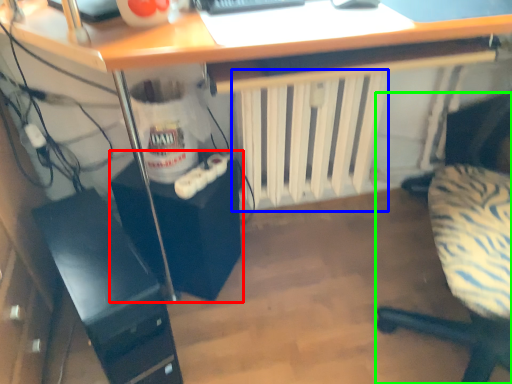
Question: Which is farther away from computer tower (highlighted by a red box)? radiator (highlighted by a blue box) or chair (highlighted by a green box)?

Choices:
 (A) radiator
 (B) chair

Answer: (B)